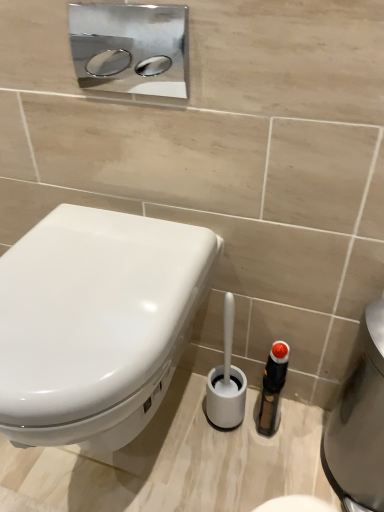
Question: From a real-world perspective, relative to white plastic toilet brush at lower center, is white glossy toilet at left vertically above or below?

Choices:
 (A) above
 (B) below

Answer: (A)

Question: From their relative heights in the image, would you say white glossy toilet at left is taller or shorter than white plastic toilet brush at lower center?

Choices:
 (A) tall
 (B) short

Answer: (A)

Question: Based on their relative distances, which object is nearer to the silver metallic water heater at lower right?

Choices:
 (A) white plastic toilet brush at lower center
 (B) white glossy toilet at left

Answer: (A)

Question: Estimate the real-world distances between objects in this image. Which object is closer to the white glossy toilet at left?

Choices:
 (A) silver metallic water heater at lower right
 (B) white plastic toilet brush at lower center

Answer: (B)